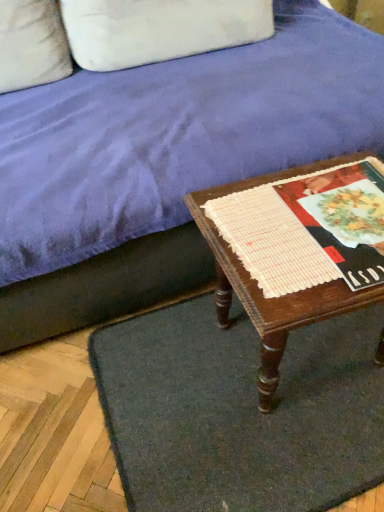
Locate an element on the screen. The width and height of the screenshot is (384, 512). free point below wooden table at lower right (from a real-world perspective) is located at coordinates (306, 356).